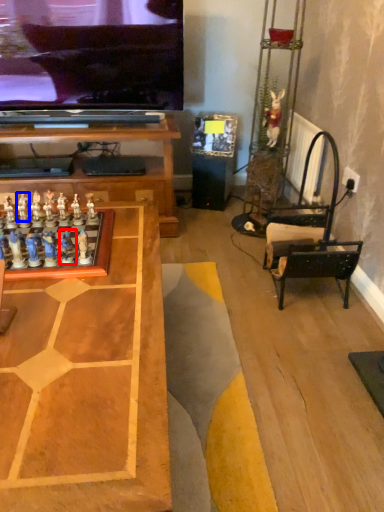
Question: Which object appears closest to the camera in this image, toy (highlighted by a red box) or toy (highlighted by a blue box)?

Choices:
 (A) toy
 (B) toy

Answer: (A)